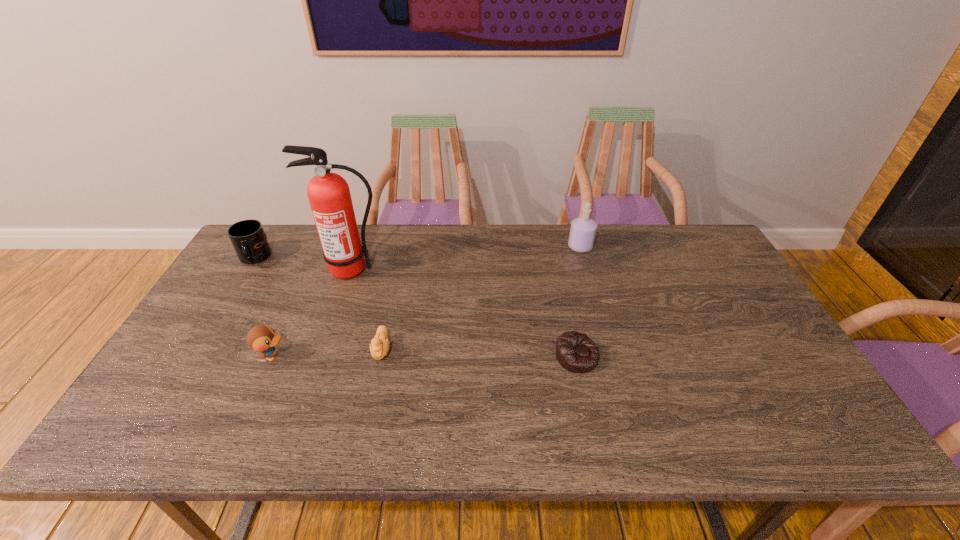
Identify the location of vacant space situated on the front-facing side of the duck. The width and height of the screenshot is (960, 540). 344,356.

Find the location of a particular element. Image resolution: width=960 pixels, height=540 pixels. vacant space located on the face of the duckling is located at coordinates (372, 392).

This screenshot has width=960, height=540. I want to click on free space located on the left of the beanbag, so click(469, 356).

Locate an element on the screen. This screenshot has height=540, width=960. fire extinguisher positioned at the far edge is located at coordinates (329, 196).

This screenshot has height=540, width=960. Find the location of `perfume located at the far edge`. perfume located at the far edge is located at coordinates (583, 230).

Identify the location of mug that is at the far edge. (248, 238).

Where is `object at the left edge`? object at the left edge is located at coordinates (248, 238).

Locate an element on the screen. The height and width of the screenshot is (540, 960). object that is positioned at the far left corner is located at coordinates (248, 238).

This screenshot has width=960, height=540. Find the location of `vacant space at the far edge`. vacant space at the far edge is located at coordinates (316, 238).

Find the location of a particular element. Image resolution: width=960 pixels, height=540 pixels. vacant space at the near edge of the desktop is located at coordinates (556, 431).